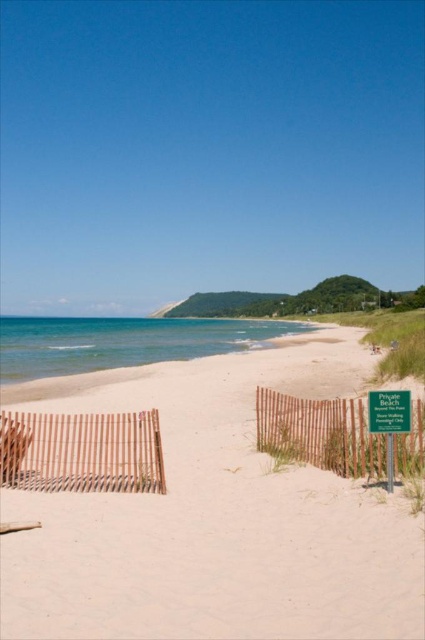
You are standing on the beach and see the brown wooden fence at lower left and the wooden slats at lower left. Which object is positioned to the right side?

The brown wooden fence at lower left is to the right of the wooden slats at lower left.

You are standing on the beach and notice the brown wooden fence at lower right and the green plastic sign at lower right. Which object is positioned lower in the scene?

The brown wooden fence at lower right is located below the green plastic sign at lower right, so it is positioned lower in the scene.

You are standing at the center of the beach scene. Which direction should you walk to reach the brown wooden fence at lower left?

You should walk towards the lower left direction to reach the brown wooden fence at lower left.